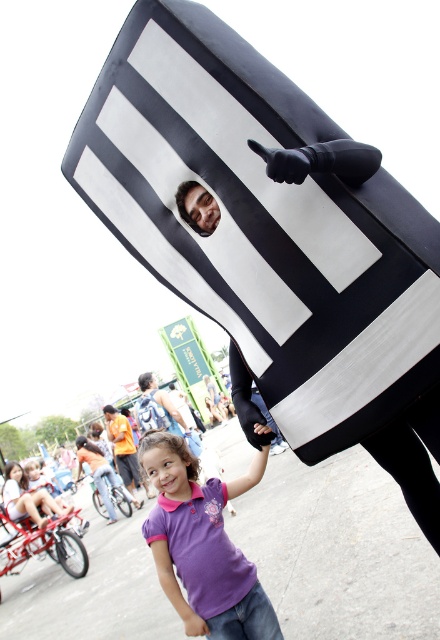
You are a photographer trying to capture both the purple cotton shirt at center and the smooth skin face at upper center in a single frame. Considering their sizes, which object should you focus on to ensure both are clearly visible?

The purple cotton shirt at center has a larger size compared to the smooth skin face at upper center, so you should focus on the purple cotton shirt at center to ensure both are clearly visible.

You are a photographer at the event and want to capture a photo that includes both the orange fabric shirt at lower left and the smooth skin face at upper center. Which object should be placed on the left side of the frame to ensure both are visible?

The orange fabric shirt at lower left should be placed on the left side of the frame because it is already positioned on the left side of the smooth skin face at upper center, ensuring both are visible when arranged this way.

Based on the scene description, can you determine which object is taller between the black matte flag at upper center and the brushed metal backpack at lower center?

The black matte flag at upper center is much taller than the brushed metal backpack at lower center.